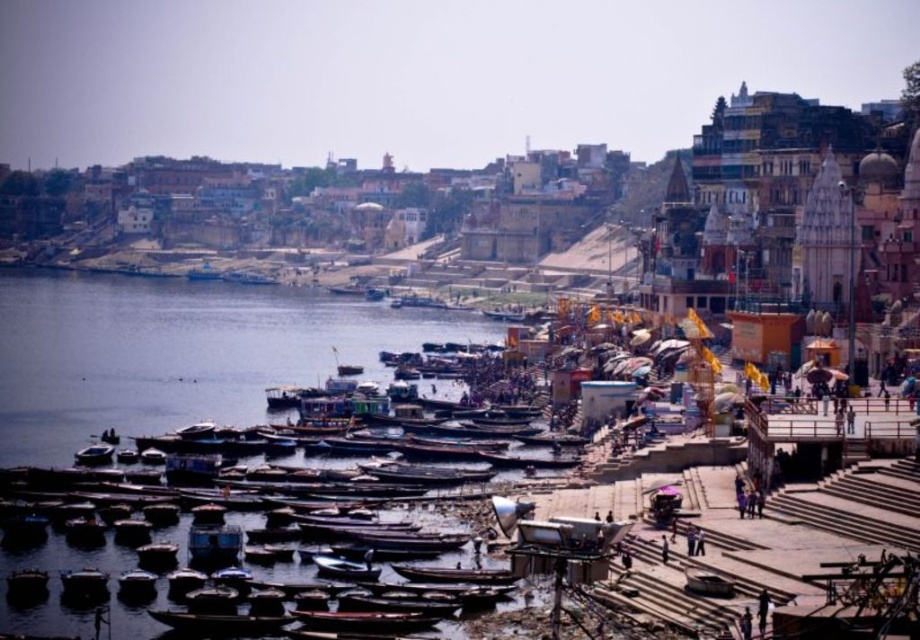
You are a tourist standing on the riverside and want to take a photo of the brown wooden boats at lower left and the wooden boat at lower left. Since you have a wide angle lens, which boat would you need to get closer to in order to capture both in the frame?

The brown wooden boats at lower left is larger in size than wooden boat at lower left, so to capture both in the frame with a wide angle lens, you should get closer to the wooden boat at lower left to avoid the larger boat from dominating the shot.

You are standing on the riverside promenade and want to take a photo of the brown wooden boats at lower left. Which direction should you face to capture them in your shot?

You should face towards the lower left direction to capture the brown wooden boats at lower left, as they are located at point coordinates of (177, 353).

You are planning to carry a group of 10 people for a short river tour. Based on the scene description, which boat would be more suitable between the wooden boats at center and the wooden boat at lower left?

The wooden boats at center are wider than the wooden boat at lower left, so they can accommodate more people and are more suitable for carrying a group of 10.